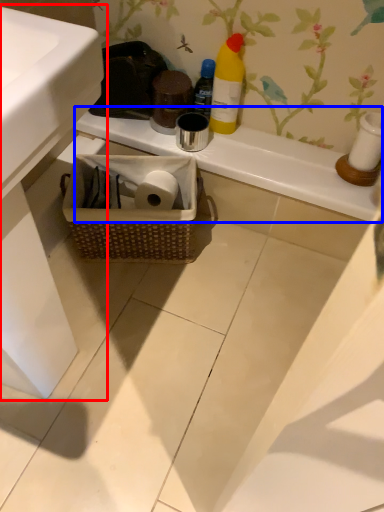
Question: Among these objects, which one is farthest to the camera, sink (highlighted by a red box) or counter top (highlighted by a blue box)?

Choices:
 (A) sink
 (B) counter top

Answer: (B)